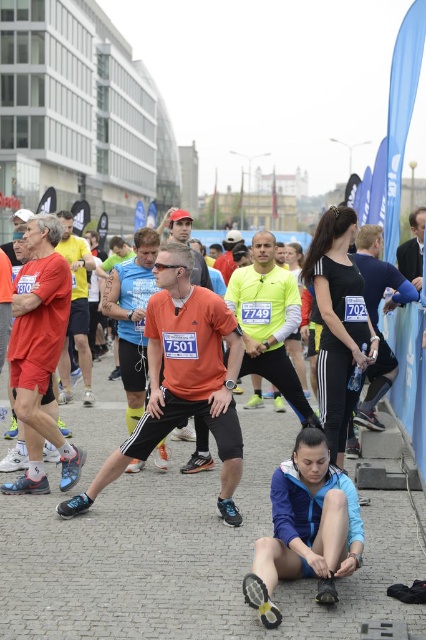
Question: Does blue fabric jacket at lower center appear on the right side of black matte running shoes at center?

Choices:
 (A) yes
 (B) no

Answer: (B)

Question: Among these objects, which one is nearest to the camera?

Choices:
 (A) black matte running shoes at center
 (B) blue fabric jacket at lower center

Answer: (B)

Question: In this image, where is blue fabric jacket at lower center located relative to black matte running shoes at center?

Choices:
 (A) above
 (B) below

Answer: (B)

Question: Can you confirm if blue fabric jacket at lower center is thinner than black matte running shoes at center?

Choices:
 (A) yes
 (B) no

Answer: (B)